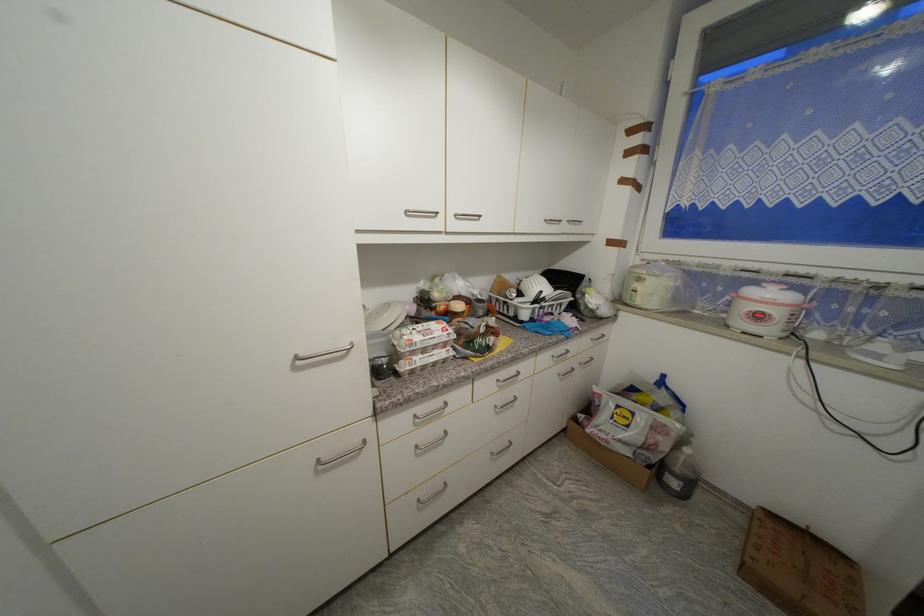
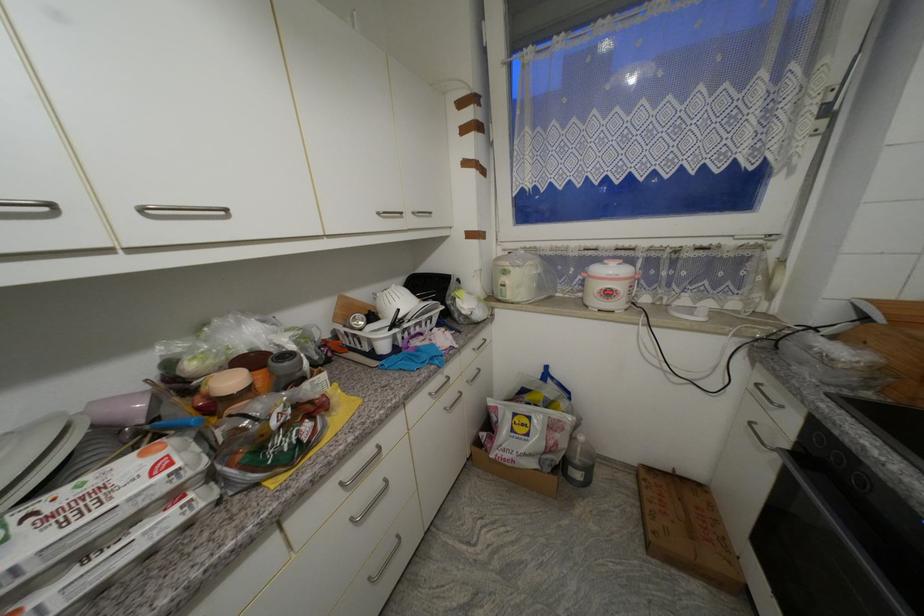
Where in the second image is the point corresponding to (x=574, y=223) from the first image?

(419, 215)